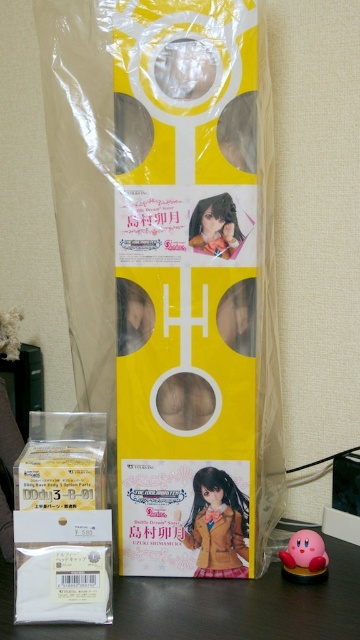
You are a customer at a store and see the yellow matte paper bag at center and the matte brown doll at center on the shelf. Which one takes up more space on the shelf?

The yellow matte paper bag at center is bigger than the matte brown doll at center, so it takes up more space on the shelf.

You are examining the packaging of a collectible item and notice two items inside the box. One is a white matte paper at lower center and the other is a matte brown doll at center. Which item is located to the left of the other?

The white matte paper at lower center is positioned on the left side of matte brown doll at center, so it is located to the left of the doll.